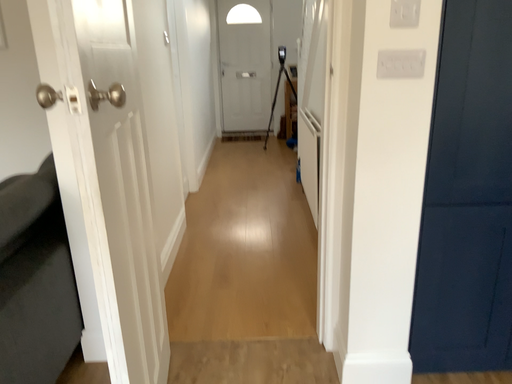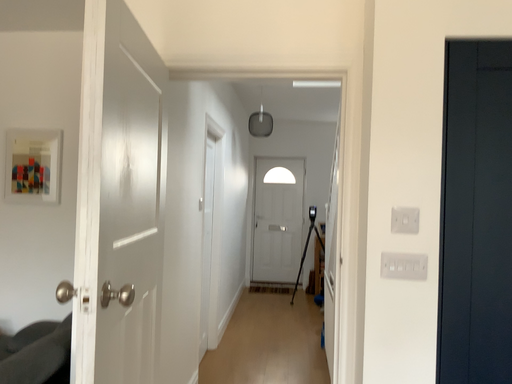
Question: How did the camera likely rotate when shooting the video?

Choices:
 (A) rotated upward
 (B) rotated downward

Answer: (A)